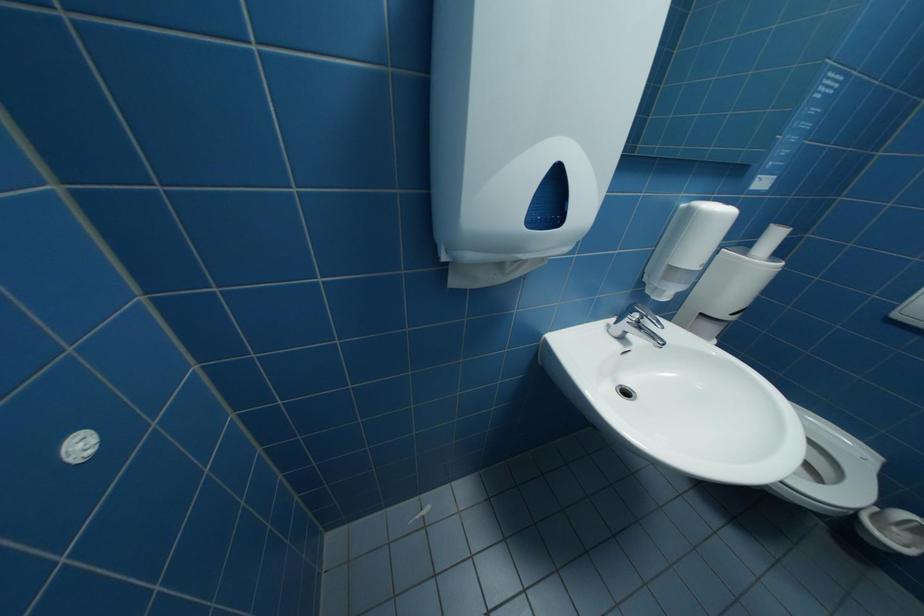
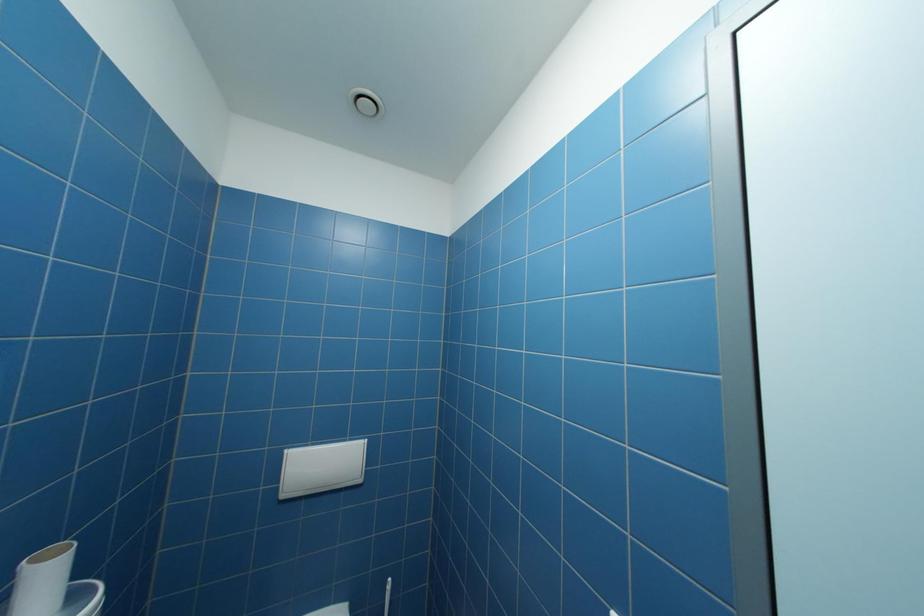
Question: Based on the continuous images, in which direction is the camera rotating? Reply with the corresponding letter.

Choices:
 (A) Left
 (B) Right
 (C) Up
 (D) Down

Answer: (B)